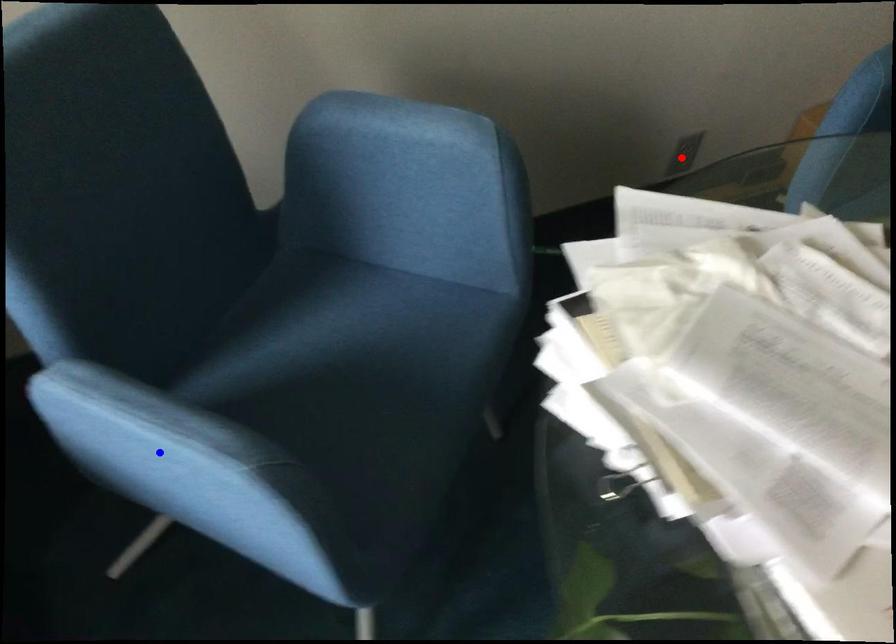
Question: Which of the two points in the image is closer to the camera?

Choices:
 (A) Blue point is closer.
 (B) Red point is closer.

Answer: (A)